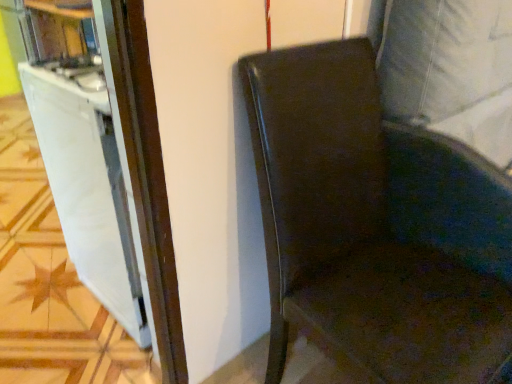
Question: Could you tell me if white glossy file cabinet at left is facing glossy leather chair at right?

Choices:
 (A) yes
 (B) no

Answer: (B)

Question: From a real-world perspective, is white glossy file cabinet at left physically above glossy leather chair at right?

Choices:
 (A) yes
 (B) no

Answer: (B)

Question: Does white glossy file cabinet at left lie in front of glossy leather chair at right?

Choices:
 (A) yes
 (B) no

Answer: (B)

Question: Does white glossy file cabinet at left appear on the right side of glossy leather chair at right?

Choices:
 (A) no
 (B) yes

Answer: (A)

Question: Is white glossy file cabinet at left wider than glossy leather chair at right?

Choices:
 (A) no
 (B) yes

Answer: (A)

Question: Is glossy leather chair at right located within white glossy file cabinet at left?

Choices:
 (A) yes
 (B) no

Answer: (B)

Question: Considering the relative positions of glossy leather chair at right and white glossy file cabinet at left in the image provided, is glossy leather chair at right in front of white glossy file cabinet at left?

Choices:
 (A) yes
 (B) no

Answer: (A)

Question: Can you confirm if glossy leather chair at right is smaller than white glossy file cabinet at left?

Choices:
 (A) yes
 (B) no

Answer: (B)

Question: Considering the relative sizes of glossy leather chair at right and white glossy file cabinet at left in the image provided, is glossy leather chair at right shorter than white glossy file cabinet at left?

Choices:
 (A) yes
 (B) no

Answer: (B)

Question: From the image's perspective, does glossy leather chair at right appear higher than white glossy file cabinet at left?

Choices:
 (A) yes
 (B) no

Answer: (B)

Question: Considering the relative sizes of glossy leather chair at right and white glossy file cabinet at left in the image provided, is glossy leather chair at right bigger than white glossy file cabinet at left?

Choices:
 (A) yes
 (B) no

Answer: (A)

Question: Considering the relative sizes of glossy leather chair at right and white glossy file cabinet at left in the image provided, is glossy leather chair at right taller than white glossy file cabinet at left?

Choices:
 (A) yes
 (B) no

Answer: (A)

Question: In the image, is white glossy file cabinet at left on the left side or the right side of glossy leather chair at right?

Choices:
 (A) left
 (B) right

Answer: (A)